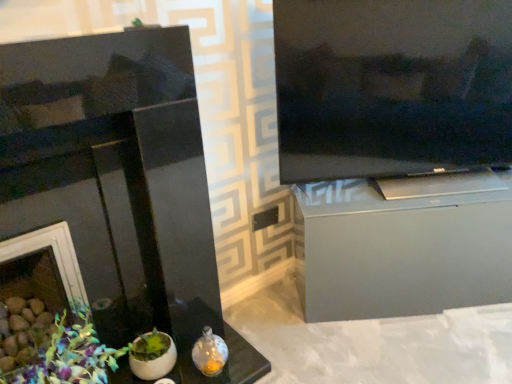
Question: Is black glossy fireplace at left with black glossy television at upper right?

Choices:
 (A) yes
 (B) no

Answer: (B)

Question: Is black glossy fireplace at left positioned far away from black glossy television at upper right?

Choices:
 (A) yes
 (B) no

Answer: (B)

Question: From a real-world perspective, is black glossy fireplace at left positioned over black glossy television at upper right based on gravity?

Choices:
 (A) yes
 (B) no

Answer: (B)

Question: Can you confirm if black glossy fireplace at left is positioned to the left of black glossy television at upper right?

Choices:
 (A) yes
 (B) no

Answer: (A)

Question: Is black glossy fireplace at left further to camera compared to black glossy television at upper right?

Choices:
 (A) no
 (B) yes

Answer: (A)

Question: From a real-world perspective, relative to black glossy television at upper right, is black glossy fireplace at left vertically above or below?

Choices:
 (A) above
 (B) below

Answer: (B)

Question: In terms of size, does black glossy fireplace at left appear bigger or smaller than black glossy television at upper right?

Choices:
 (A) big
 (B) small

Answer: (A)

Question: Does point (150, 218) appear closer or farther from the camera than point (422, 100)?

Choices:
 (A) farther
 (B) closer

Answer: (B)

Question: Is black glossy fireplace at left to the left or to the right of black glossy television at upper right in the image?

Choices:
 (A) right
 (B) left

Answer: (B)

Question: Which is correct: black glossy television at upper right is inside black glossy fireplace at left, or outside of it?

Choices:
 (A) outside
 (B) inside

Answer: (A)

Question: Does point (407, 79) appear closer or farther from the camera than point (34, 79)?

Choices:
 (A) farther
 (B) closer

Answer: (A)

Question: From a real-world perspective, is black glossy television at upper right above or below black glossy fireplace at left?

Choices:
 (A) above
 (B) below

Answer: (A)

Question: From the image's perspective, is black glossy television at upper right positioned above or below black glossy fireplace at left?

Choices:
 (A) above
 (B) below

Answer: (A)

Question: Looking at the image, does satin silver cabinet at right seem bigger or smaller compared to black glossy television at upper right?

Choices:
 (A) big
 (B) small

Answer: (A)

Question: Would you say satin silver cabinet at right is inside or outside black glossy television at upper right?

Choices:
 (A) outside
 (B) inside

Answer: (A)